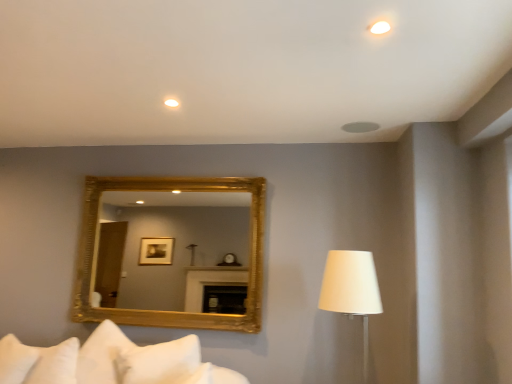
Identify the location of free spot in front of white matte ceiling light at upper center, the second lighting positioned from the front. The height and width of the screenshot is (384, 512). (164, 87).